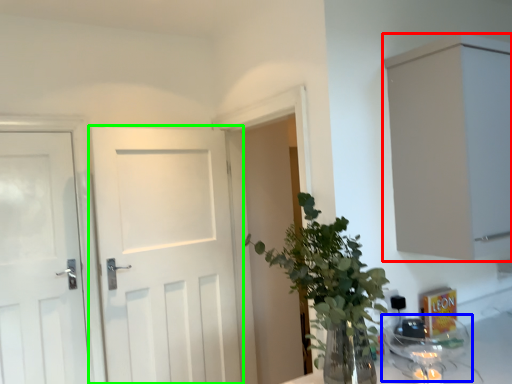
Question: Estimate the real-world distances between objects in this image. Which object is farther from cabinetry (highlighted by a red box), glass jar (highlighted by a blue box) or door (highlighted by a green box)?

Choices:
 (A) glass jar
 (B) door

Answer: (B)